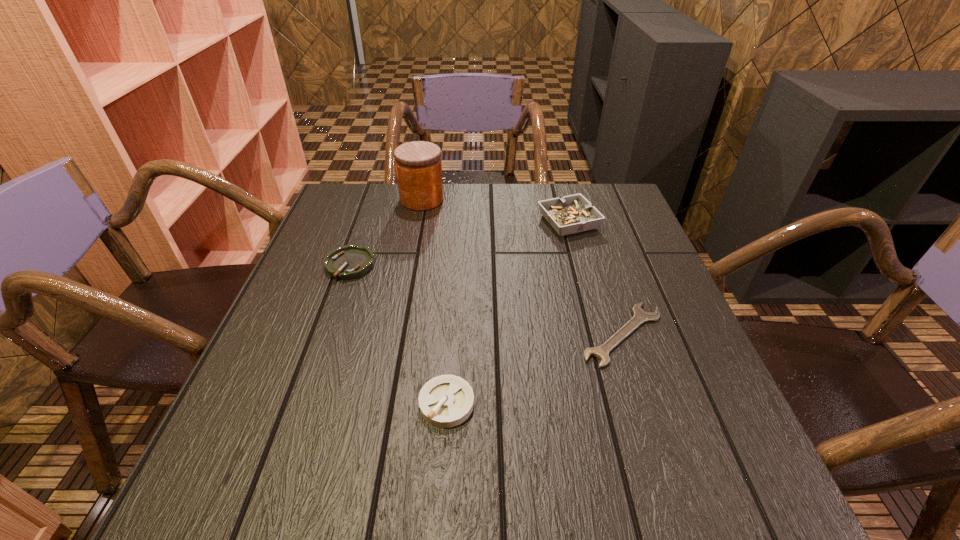
Find the location of `free space at the far edge of the desktop`. free space at the far edge of the desktop is located at coordinates (495, 226).

The image size is (960, 540). What are the coordinates of `vacant space at the near edge of the desktop` in the screenshot? It's located at (556, 475).

This screenshot has width=960, height=540. What are the coordinates of `free spot at the left edge of the desktop` in the screenshot? It's located at (274, 326).

In the image, there is a desktop. Identify the location of vacant space at the right edge. This screenshot has height=540, width=960. (677, 298).

The height and width of the screenshot is (540, 960). Identify the location of vacant space at the far left corner of the desktop. (364, 221).

In the image, there is a desktop. Where is `vacant region at the far right corner`? The image size is (960, 540). vacant region at the far right corner is located at coordinates (620, 193).

Identify the location of unoccupied area between the second ashtray from left to right and the fourth shortest object. 508,313.

Locate an element on the screen. free spot between the tallest object and the wrench is located at coordinates (522, 267).

Locate an element on the screen. The width and height of the screenshot is (960, 540). unoccupied position between the shortest ashtray and the jar is located at coordinates (386, 232).

Identify the location of vacant space in between the jar and the nearest object. (434, 301).